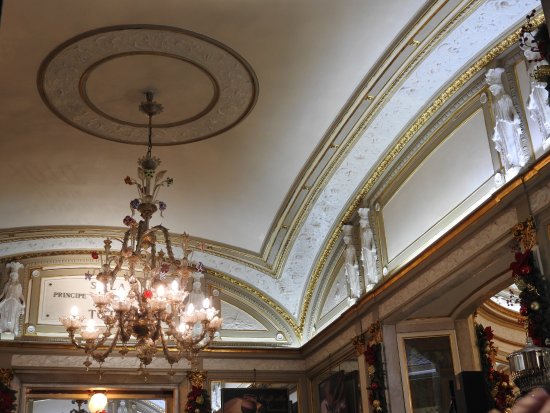
Locate an element on the screen. ceiling is located at coordinates (117, 93).